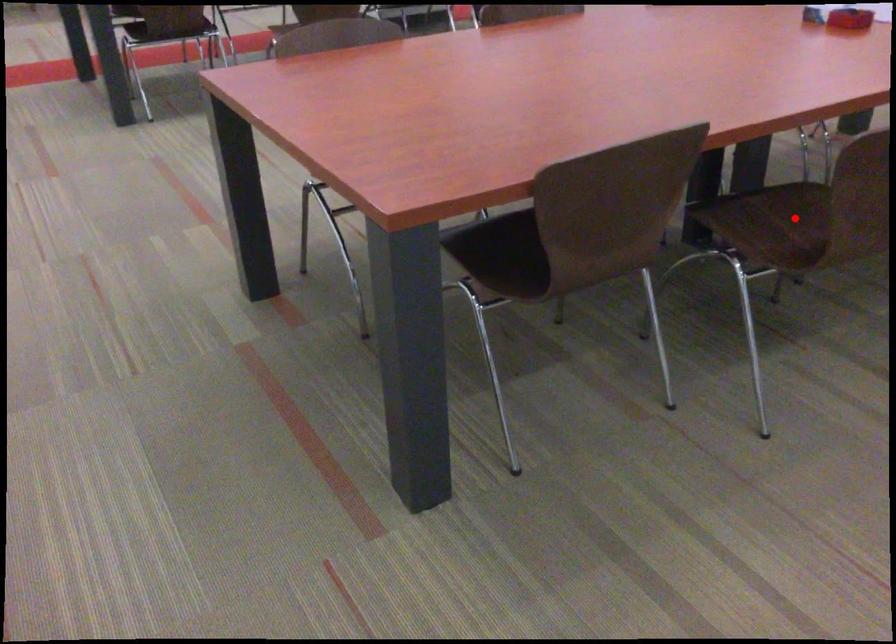
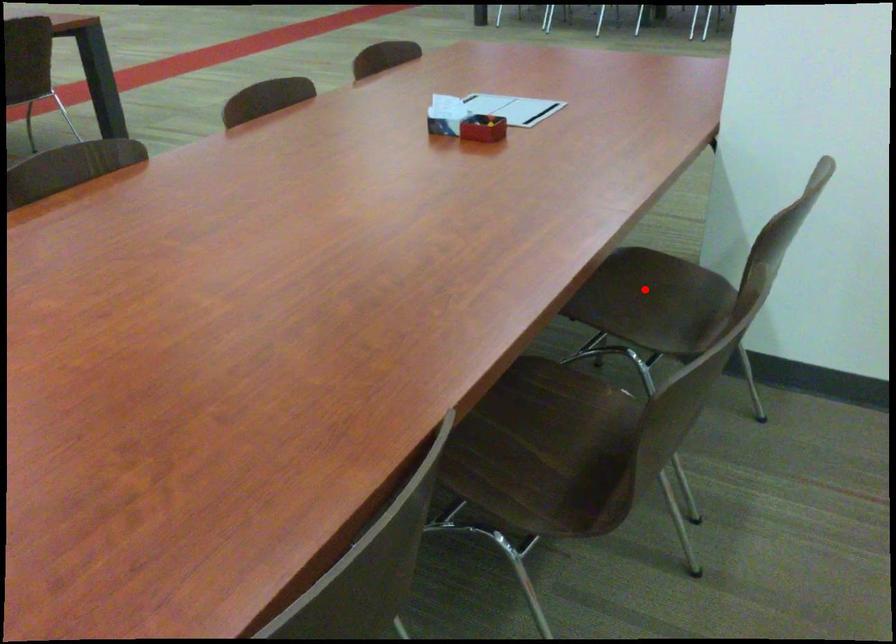
I am providing you with two images of the same scene from different viewpoints. A red point is marked on the first image and another point is marked on the second image. Does the point marked in image1 correspond to the same location as the one in image2?

No